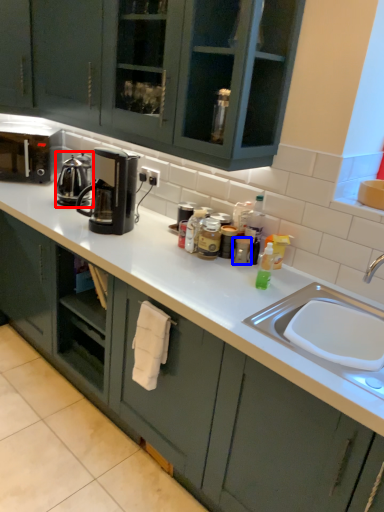
Question: Which object appears closest to the camera in this image, kitchen appliance (highlighted by a red box) or appliance (highlighted by a blue box)?

Choices:
 (A) kitchen appliance
 (B) appliance

Answer: (B)